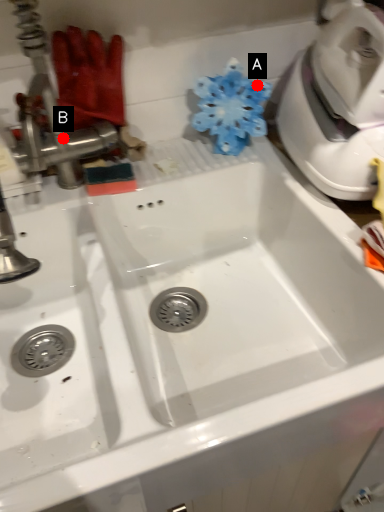
Question: Two points are circled on the image, labeled by A and B beside each circle. Which point is closer to the camera taking this photo?

Choices:
 (A) A is closer
 (B) B is closer

Answer: (B)